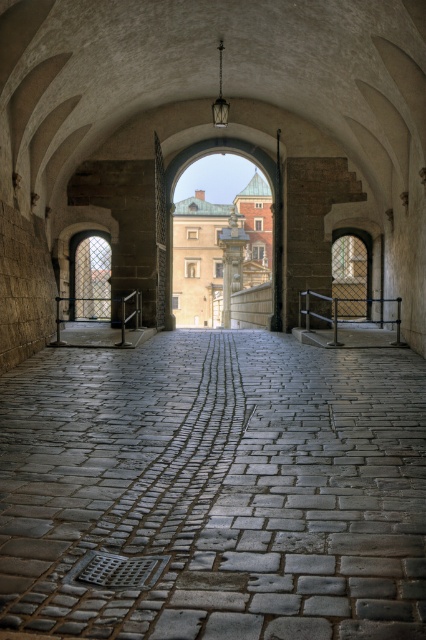
Does gray cobblestone path at center have a greater width compared to smooth stone pillar at center?

Yes.

Can you confirm if gray cobblestone path at center is positioned above smooth stone pillar at center?

Actually, gray cobblestone path at center is below smooth stone pillar at center.

Is point (230, 470) positioned after point (233, 216)?

No, (230, 470) is in front of (233, 216).

Image resolution: width=426 pixels, height=640 pixels. I want to click on gray cobblestone path at center, so click(215, 490).